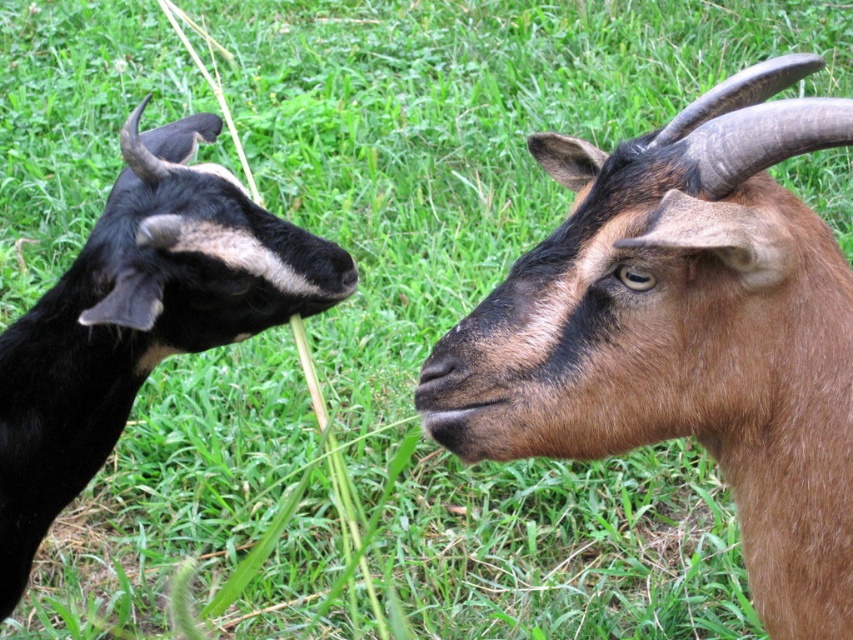
Describe the element at coordinates (683, 332) in the screenshot. The width and height of the screenshot is (853, 640). I see `brown furry goat at right` at that location.

Between point (827, 444) and point (67, 452), which one is positioned in front?

Point (827, 444) is more forward.

Where is `brown furry goat at right`? brown furry goat at right is located at coordinates (683, 332).